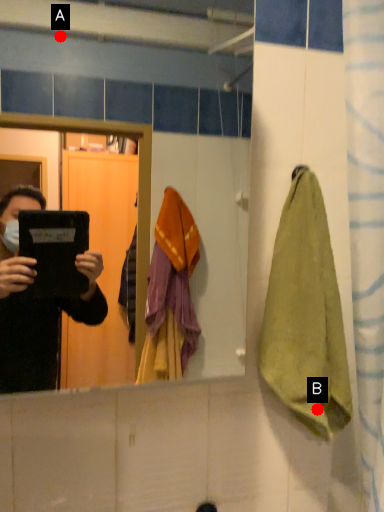
Question: Two points are circled on the image, labeled by A and B beside each circle. Which point is further to the camera?

Choices:
 (A) A is further
 (B) B is further

Answer: (A)